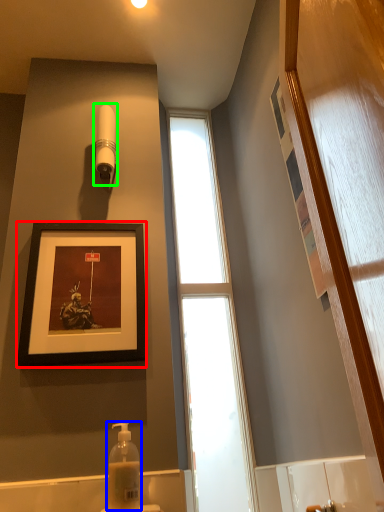
Question: Which object is positioned closest to picture frame (highlighted by a red box)? Select from soap dispenser (highlighted by a blue box) and shower (highlighted by a green box).

Choices:
 (A) soap dispenser
 (B) shower

Answer: (A)